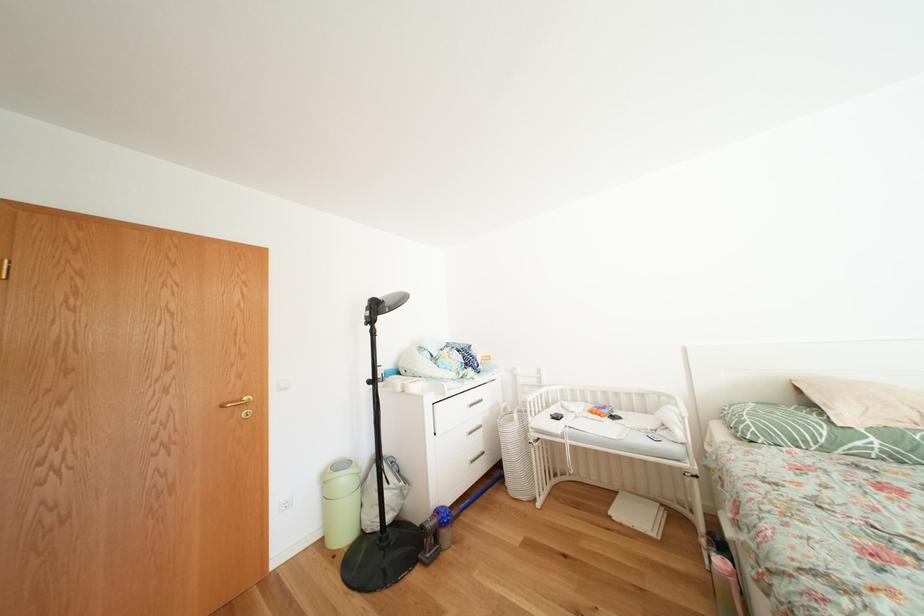
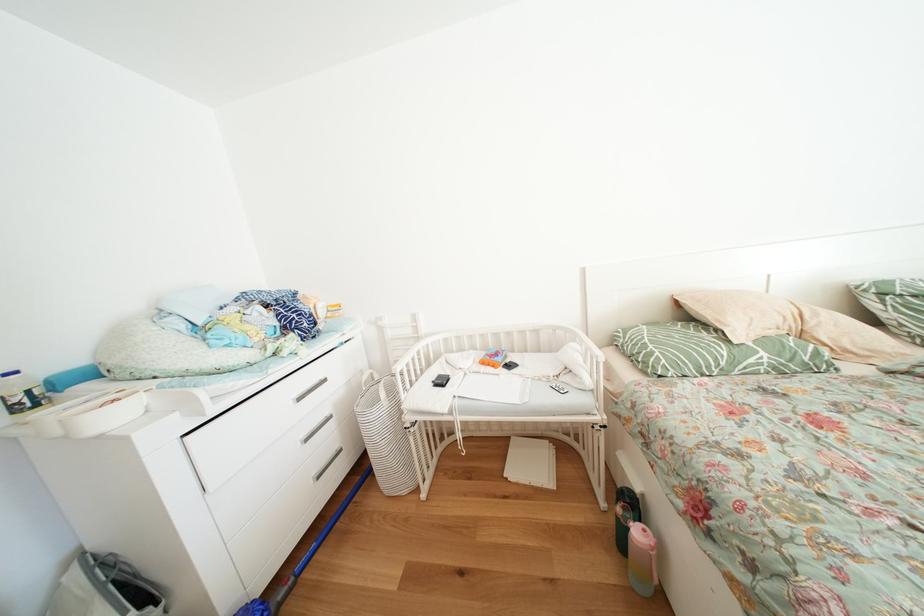
In the second image, find the point that corresponds to [601,411] in the first image.

(491, 360)